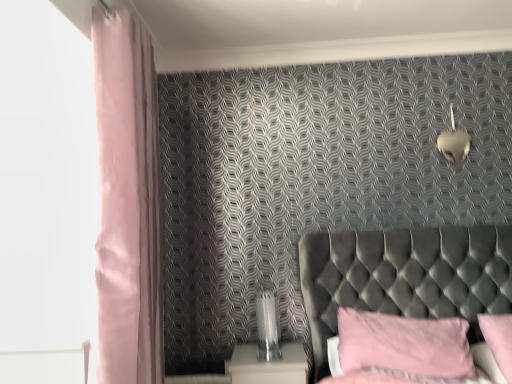
The height and width of the screenshot is (384, 512). What do you see at coordinates (499, 340) in the screenshot? I see `pink fabric pillow at lower right, marked as the 1th pillow in a right-to-left arrangement` at bounding box center [499, 340].

The width and height of the screenshot is (512, 384). In order to click on white glossy nightstand at lower center in this screenshot , I will do `click(268, 365)`.

Describe the element at coordinates (128, 203) in the screenshot. I see `matte pink curtain at left` at that location.

Where is `clear glass table lamp at center`? This screenshot has width=512, height=384. clear glass table lamp at center is located at coordinates (268, 326).

Where is `tufted velvet headboard at right`? The image size is (512, 384). tufted velvet headboard at right is located at coordinates (404, 276).

How different are the orientations of metallic heart-shaped light fixture at upper right and tufted velvet headboard at right in degrees?

The angle between the facing direction of metallic heart-shaped light fixture at upper right and the facing direction of tufted velvet headboard at right is 0.93 degrees.

Considering the relative sizes of metallic heart-shaped light fixture at upper right and tufted velvet headboard at right in the image provided, is metallic heart-shaped light fixture at upper right bigger than tufted velvet headboard at right?

No.

Which object is closer to the camera taking this photo, metallic heart-shaped light fixture at upper right or tufted velvet headboard at right?

tufted velvet headboard at right is in front.

From a real-world perspective, is metallic heart-shaped light fixture at upper right above or below tufted velvet headboard at right?

metallic heart-shaped light fixture at upper right is situated higher than tufted velvet headboard at right in the real world.

Is matte pink curtain at left situated inside white glossy nightstand at lower center or outside?

matte pink curtain at left is outside white glossy nightstand at lower center.

Considering the sizes of objects matte pink curtain at left and white glossy nightstand at lower center in the image provided, who is taller, matte pink curtain at left or white glossy nightstand at lower center?

matte pink curtain at left.

Who is smaller, matte pink curtain at left or white glossy nightstand at lower center?

white glossy nightstand at lower center.

Which object is closer to the camera, metallic heart-shaped light fixture at upper right or pink fabric pillow at lower right, acting as the 1th pillow starting from the left?

Positioned in front is pink fabric pillow at lower right, acting as the 1th pillow starting from the left.

From the image's perspective, is metallic heart-shaped light fixture at upper right positioned above or below pink fabric pillow at lower right, acting as the 1th pillow starting from the left?

From the image's perspective, metallic heart-shaped light fixture at upper right appears above pink fabric pillow at lower right, acting as the 1th pillow starting from the left.

Considering the relative positions of metallic heart-shaped light fixture at upper right and pink fabric pillow at lower right, the second pillow viewed from the right, in the image provided, is metallic heart-shaped light fixture at upper right to the left or to the right of pink fabric pillow at lower right, the second pillow viewed from the right,?

In the image, metallic heart-shaped light fixture at upper right appears on the right side of pink fabric pillow at lower right, the second pillow viewed from the right.

Does metallic heart-shaped light fixture at upper right have a greater width compared to pink fabric pillow at lower right, the second pillow viewed from the right?

No, metallic heart-shaped light fixture at upper right is not wider than pink fabric pillow at lower right, the second pillow viewed from the right.

How different are the orientations of pink fabric pillow at lower right, the second pillow viewed from the right, and matte pink curtain at left in degrees?

89.1 degrees separate the facing orientations of pink fabric pillow at lower right, the second pillow viewed from the right, and matte pink curtain at left.

From the image's perspective, is pink fabric pillow at lower right, acting as the 1th pillow starting from the left, above or below matte pink curtain at left?

pink fabric pillow at lower right, acting as the 1th pillow starting from the left, is below matte pink curtain at left.

From a real-world perspective, who is located lower, pink fabric pillow at lower right, acting as the 1th pillow starting from the left, or matte pink curtain at left?

In real-world perspective, pink fabric pillow at lower right, acting as the 1th pillow starting from the left, is lower.

Considering the relative positions of pink fabric pillow at lower right, acting as the 1th pillow starting from the left, and matte pink curtain at left in the image provided, is pink fabric pillow at lower right, acting as the 1th pillow starting from the left, to the left of matte pink curtain at left from the viewer's perspective?

Incorrect, pink fabric pillow at lower right, acting as the 1th pillow starting from the left, is not on the left side of matte pink curtain at left.

Can you confirm if clear glass table lamp at center is bigger than pink fabric pillow at lower right, the second pillow viewed from the right?

Incorrect, clear glass table lamp at center is not larger than pink fabric pillow at lower right, the second pillow viewed from the right.

Can you confirm if clear glass table lamp at center is thinner than pink fabric pillow at lower right, acting as the 1th pillow starting from the left?

Yes.

How distant is clear glass table lamp at center from pink fabric pillow at lower right, the second pillow viewed from the right?

They are 23.58 inches apart.

Is clear glass table lamp at center situated inside pink fabric pillow at lower right, the second pillow viewed from the right, or outside?

clear glass table lamp at center is outside pink fabric pillow at lower right, the second pillow viewed from the right.

This screenshot has width=512, height=384. What are the coordinates of `light fixture on the right of clear glass table lamp at center` in the screenshot? It's located at pyautogui.click(x=453, y=142).

Are clear glass table lamp at center and metallic heart-shaped light fixture at upper right located far from each other?

clear glass table lamp at center is positioned a significant distance from metallic heart-shaped light fixture at upper right.

Is point (261, 309) positioned after point (450, 137)?

No, it is not.

Is clear glass table lamp at center not within metallic heart-shaped light fixture at upper right?

Yes, clear glass table lamp at center is located beyond the bounds of metallic heart-shaped light fixture at upper right.

Consider the image. Would you say tufted velvet headboard at right is a long distance from metallic heart-shaped light fixture at upper right?

No, tufted velvet headboard at right is not far away from metallic heart-shaped light fixture at upper right.

Does tufted velvet headboard at right turn towards metallic heart-shaped light fixture at upper right?

No, tufted velvet headboard at right does not turn towards metallic heart-shaped light fixture at upper right.

Would you say tufted velvet headboard at right is to the left or to the right of metallic heart-shaped light fixture at upper right in the picture?

tufted velvet headboard at right is positioned on metallic heart-shaped light fixture at upper right's left side.

The image size is (512, 384). In order to click on light fixture above the tufted velvet headboard at right (from the image's perspective) in this screenshot , I will do `click(453, 142)`.

Where is `nightstand below the matte pink curtain at left (from a real-world perspective)`? nightstand below the matte pink curtain at left (from a real-world perspective) is located at coordinates click(x=268, y=365).

Considering their positions, is white glossy nightstand at lower center positioned closer to pink fabric pillow at lower right, placed as the second pillow when sorted from left to right, than metallic heart-shaped light fixture at upper right?

metallic heart-shaped light fixture at upper right is closer to pink fabric pillow at lower right, placed as the second pillow when sorted from left to right.

When comparing their distances from tufted velvet headboard at right, does pink fabric pillow at lower right, acting as the 1th pillow starting from the left, or metallic heart-shaped light fixture at upper right seem closer?

Based on the image, pink fabric pillow at lower right, acting as the 1th pillow starting from the left, appears to be nearer to tufted velvet headboard at right.

In the scene shown: Looking at the image, which one is located closer to clear glass table lamp at center, pink fabric pillow at lower right, marked as the 1th pillow in a right-to-left arrangement, or white glossy nightstand at lower center?

white glossy nightstand at lower center lies closer to clear glass table lamp at center than the other object.

Based on their spatial positions, is white glossy nightstand at lower center or pink fabric pillow at lower right, acting as the 1th pillow starting from the left, further from pink fabric pillow at lower right, marked as the 1th pillow in a right-to-left arrangement?

Based on the image, white glossy nightstand at lower center appears to be further to pink fabric pillow at lower right, marked as the 1th pillow in a right-to-left arrangement.

Which object lies nearer to the anchor point metallic heart-shaped light fixture at upper right, white glossy nightstand at lower center or clear glass table lamp at center?

The object closer to metallic heart-shaped light fixture at upper right is clear glass table lamp at center.

Based on their spatial positions, is pink fabric pillow at lower right, placed as the second pillow when sorted from left to right, or matte pink curtain at left further from pink fabric pillow at lower right, acting as the 1th pillow starting from the left?

The object further to pink fabric pillow at lower right, acting as the 1th pillow starting from the left, is matte pink curtain at left.

From the image, which object appears to be farther from pink fabric pillow at lower right, the second pillow viewed from the right, matte pink curtain at left or clear glass table lamp at center?

matte pink curtain at left is positioned further to the anchor pink fabric pillow at lower right, the second pillow viewed from the right.

Estimate the real-world distances between objects in this image. Which object is further from pink fabric pillow at lower right, marked as the 1th pillow in a right-to-left arrangement, pink fabric pillow at lower right, the second pillow viewed from the right, or clear glass table lamp at center?

clear glass table lamp at center is further to pink fabric pillow at lower right, marked as the 1th pillow in a right-to-left arrangement.

You are a GUI agent. You are given a task and a screenshot of the screen. Output one action in this format:
    pyautogui.click(x=<x>, y=<y>)
    Task: Click on the pillow situated between matte pink curtain at left and metallic heart-shaped light fixture at upper right from left to right
    
    Given the screenshot: What is the action you would take?
    pyautogui.click(x=404, y=344)

You are a GUI agent. You are given a task and a screenshot of the screen. Output one action in this format:
    pyautogui.click(x=<x>, y=<y>)
    Task: Click on the nightstand situated between matte pink curtain at left and pink fabric pillow at lower right, acting as the 1th pillow starting from the left, from left to right
    
    Given the screenshot: What is the action you would take?
    pyautogui.click(x=268, y=365)

I want to click on pillow between matte pink curtain at left and pink fabric pillow at lower right, marked as the 1th pillow in a right-to-left arrangement, from left to right, so click(404, 344).

This screenshot has width=512, height=384. In order to click on table lamp between tufted velvet headboard at right and metallic heart-shaped light fixture at upper right in the front-back direction in this screenshot , I will do `click(268, 326)`.